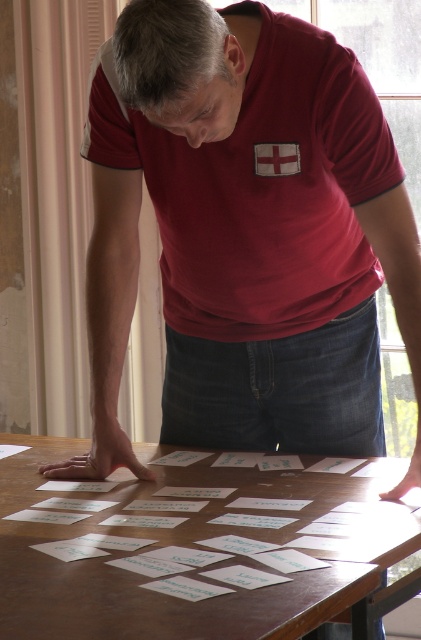
Does matte red t-shirt at center appear over brown wooden table at center?

Yes.

Between matte red t-shirt at center and brown wooden table at center, which one has less height?

Standing shorter between the two is brown wooden table at center.

Does point (253, 93) lie behind point (111, 531)?

That is True.

Locate an element on the screen. matte red t-shirt at center is located at coordinates (261, 188).